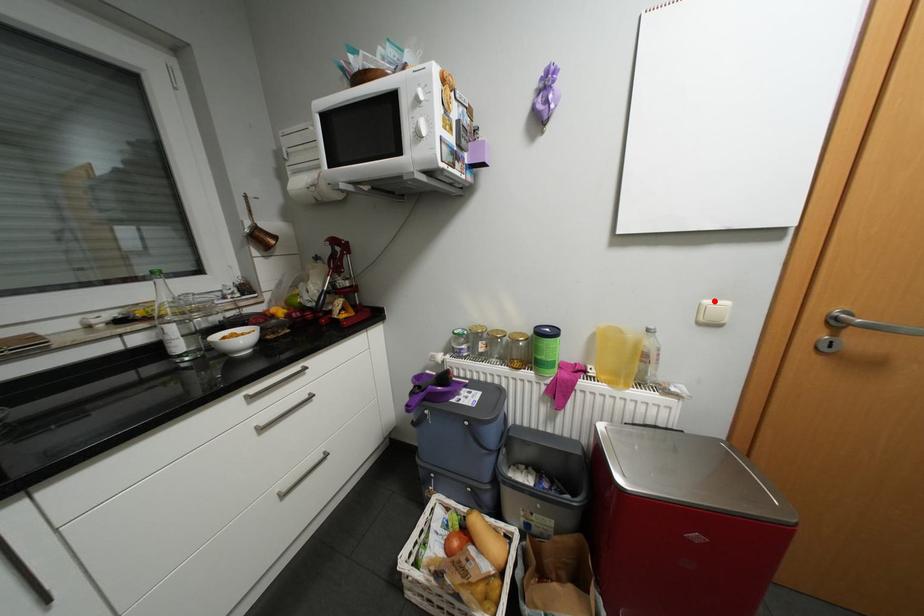
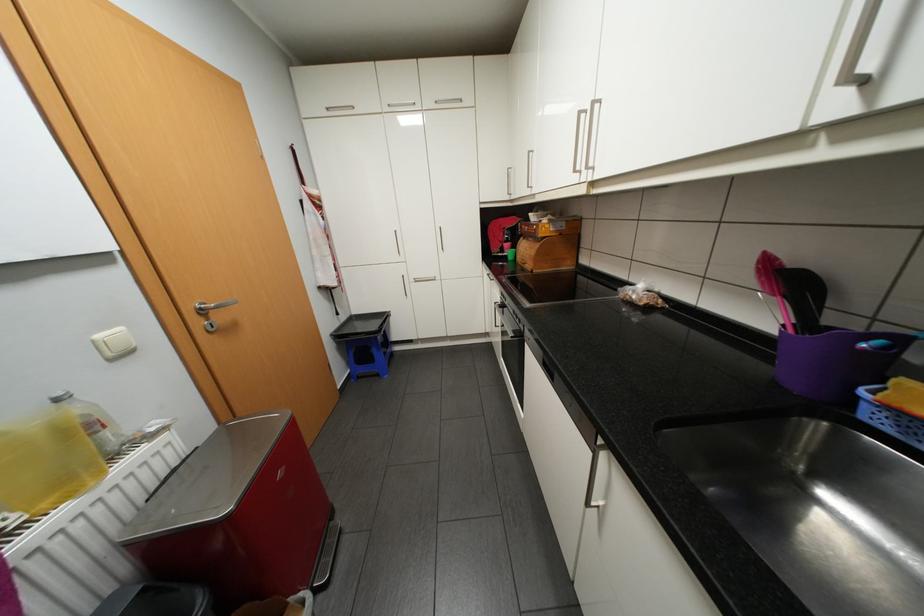
Find the pixel in the second image that matches the highlighted location in the first image.

(106, 334)